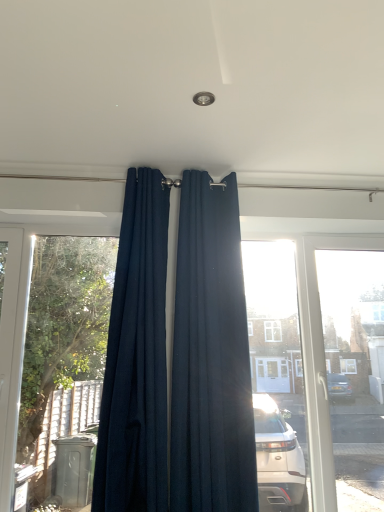
What do you see at coordinates (211, 357) in the screenshot?
I see `navy blue fabric curtain at center, the 1th curtain positioned from the right` at bounding box center [211, 357].

Find the location of `navy blue fabric curtain at center, the 1th curtain positioned from the right`. navy blue fabric curtain at center, the 1th curtain positioned from the right is located at coordinates click(x=211, y=357).

How much space does navy blue fabric curtain at center, which appears as the first curtain when viewed from the left, occupy horizontally?

The width of navy blue fabric curtain at center, which appears as the first curtain when viewed from the left, is 5.21 inches.

Find the location of a particular element. navy blue fabric curtain at center, which appears as the first curtain when viewed from the left is located at coordinates (136, 358).

The image size is (384, 512). What do you see at coordinates (136, 358) in the screenshot?
I see `navy blue fabric curtain at center, which appears as the first curtain when viewed from the left` at bounding box center [136, 358].

Identify the location of navy blue fabric curtain at center, the second curtain positioned from the left. This screenshot has height=512, width=384. (211, 357).

Considering the relative positions of navy blue fabric curtain at center, the second curtain positioned from the left, and navy blue fabric curtain at center, which appears as the first curtain when viewed from the left, in the image provided, is navy blue fabric curtain at center, the second curtain positioned from the left, to the left of navy blue fabric curtain at center, which appears as the first curtain when viewed from the left, from the viewer's perspective?

Incorrect, navy blue fabric curtain at center, the second curtain positioned from the left, is not on the left side of navy blue fabric curtain at center, which appears as the first curtain when viewed from the left.

Which object is closer to the camera taking this photo, navy blue fabric curtain at center, the second curtain positioned from the left, or navy blue fabric curtain at center, which appears as the first curtain when viewed from the left?

Positioned in front is navy blue fabric curtain at center, which appears as the first curtain when viewed from the left.

Is point (118, 307) positioned behind point (143, 326)?

Yes, point (118, 307) is behind point (143, 326).

From the image's perspective, is navy blue fabric curtain at center, the second curtain positioned from the left, located above navy blue fabric curtain at center, which appears as the first curtain when viewed from the left?

Incorrect, from the image's perspective, navy blue fabric curtain at center, the second curtain positioned from the left, is lower than navy blue fabric curtain at center, which appears as the first curtain when viewed from the left.

From a real-world perspective, which is physically above, navy blue fabric curtain at center, the second curtain positioned from the left, or navy blue fabric curtain at center, the 2th curtain when ordered from right to left?

navy blue fabric curtain at center, the 2th curtain when ordered from right to left, from a real-world perspective.

Between navy blue fabric curtain at center, the second curtain positioned from the left, and navy blue fabric curtain at center, which appears as the first curtain when viewed from the left, which one has larger width?

Wider between the two is navy blue fabric curtain at center, the second curtain positioned from the left.

Is navy blue fabric curtain at center, the second curtain positioned from the left, taller than navy blue fabric curtain at center, the 2th curtain when ordered from right to left?

Yes.

Is navy blue fabric curtain at center, the 1th curtain positioned from the right, smaller than navy blue fabric curtain at center, the 2th curtain when ordered from right to left?

No.

Do you think navy blue fabric curtain at center, the second curtain positioned from the left, is within navy blue fabric curtain at center, which appears as the first curtain when viewed from the left, or outside of it?

navy blue fabric curtain at center, the second curtain positioned from the left, is spatially situated outside navy blue fabric curtain at center, which appears as the first curtain when viewed from the left.

Is navy blue fabric curtain at center, the second curtain positioned from the left, directly adjacent to navy blue fabric curtain at center, the 2th curtain when ordered from right to left?

No, navy blue fabric curtain at center, the second curtain positioned from the left, is not with navy blue fabric curtain at center, the 2th curtain when ordered from right to left.

Is navy blue fabric curtain at center, the 1th curtain positioned from the right, turned away from navy blue fabric curtain at center, which appears as the first curtain when viewed from the left?

navy blue fabric curtain at center, the 1th curtain positioned from the right, is not turned away from navy blue fabric curtain at center, which appears as the first curtain when viewed from the left.

How far apart are navy blue fabric curtain at center, the second curtain positioned from the left, and navy blue fabric curtain at center, the 2th curtain when ordered from right to left?

The distance of navy blue fabric curtain at center, the second curtain positioned from the left, from navy blue fabric curtain at center, the 2th curtain when ordered from right to left, is 4.21 inches.

The height and width of the screenshot is (512, 384). Find the location of `curtain above the navy blue fabric curtain at center, the 1th curtain positioned from the right (from a real-world perspective)`. curtain above the navy blue fabric curtain at center, the 1th curtain positioned from the right (from a real-world perspective) is located at coordinates (136, 358).

Which object is positioned more to the right, navy blue fabric curtain at center, which appears as the first curtain when viewed from the left, or navy blue fabric curtain at center, the second curtain positioned from the left?

navy blue fabric curtain at center, the second curtain positioned from the left, is more to the right.

Which object is closer to the camera, navy blue fabric curtain at center, which appears as the first curtain when viewed from the left, or navy blue fabric curtain at center, the second curtain positioned from the left?

navy blue fabric curtain at center, which appears as the first curtain when viewed from the left, is closer to the camera.

Between point (123, 232) and point (206, 309), which one is positioned behind?

Positioned behind is point (123, 232).

From the image's perspective, relative to navy blue fabric curtain at center, the 1th curtain positioned from the right, is navy blue fabric curtain at center, the 2th curtain when ordered from right to left, above or below?

From the image's perspective, navy blue fabric curtain at center, the 2th curtain when ordered from right to left, appears above navy blue fabric curtain at center, the 1th curtain positioned from the right.

From a real-world perspective, is navy blue fabric curtain at center, which appears as the first curtain when viewed from the left, located higher than navy blue fabric curtain at center, the second curtain positioned from the left?

Yes.

Considering the sizes of objects navy blue fabric curtain at center, the 2th curtain when ordered from right to left, and navy blue fabric curtain at center, the 1th curtain positioned from the right, in the image provided, who is thinner, navy blue fabric curtain at center, the 2th curtain when ordered from right to left, or navy blue fabric curtain at center, the 1th curtain positioned from the right,?

With smaller width is navy blue fabric curtain at center, the 2th curtain when ordered from right to left.

Can you confirm if navy blue fabric curtain at center, the 2th curtain when ordered from right to left, is shorter than navy blue fabric curtain at center, the 1th curtain positioned from the right?

Yes, navy blue fabric curtain at center, the 2th curtain when ordered from right to left, is shorter than navy blue fabric curtain at center, the 1th curtain positioned from the right.

Considering the relative sizes of navy blue fabric curtain at center, the 2th curtain when ordered from right to left, and navy blue fabric curtain at center, the second curtain positioned from the left, in the image provided, is navy blue fabric curtain at center, the 2th curtain when ordered from right to left, bigger than navy blue fabric curtain at center, the second curtain positioned from the left,?

No, navy blue fabric curtain at center, the 2th curtain when ordered from right to left, is not bigger than navy blue fabric curtain at center, the second curtain positioned from the left.

From the picture: Would you say navy blue fabric curtain at center, the 2th curtain when ordered from right to left, contains navy blue fabric curtain at center, the second curtain positioned from the left?

No, navy blue fabric curtain at center, the second curtain positioned from the left, is not inside navy blue fabric curtain at center, the 2th curtain when ordered from right to left.

Is navy blue fabric curtain at center, which appears as the first curtain when viewed from the left, far from navy blue fabric curtain at center, the second curtain positioned from the left?

navy blue fabric curtain at center, which appears as the first curtain when viewed from the left, is actually quite close to navy blue fabric curtain at center, the second curtain positioned from the left.

Is navy blue fabric curtain at center, which appears as the first curtain when viewed from the left, facing away from navy blue fabric curtain at center, the second curtain positioned from the left?

That's not correct — navy blue fabric curtain at center, which appears as the first curtain when viewed from the left, is not looking away from navy blue fabric curtain at center, the second curtain positioned from the left.

In the scene shown: How many degrees apart are the facing directions of navy blue fabric curtain at center, the 2th curtain when ordered from right to left, and navy blue fabric curtain at center, the 1th curtain positioned from the right?

The facing directions of navy blue fabric curtain at center, the 2th curtain when ordered from right to left, and navy blue fabric curtain at center, the 1th curtain positioned from the right, are 0.000348 degrees apart.

You are a GUI agent. You are given a task and a screenshot of the screen. Output one action in this format:
    pyautogui.click(x=<x>, y=<y>)
    Task: Click on the curtain above the navy blue fabric curtain at center, the second curtain positioned from the left (from the image's perspective)
    
    Given the screenshot: What is the action you would take?
    pyautogui.click(x=136, y=358)

This screenshot has height=512, width=384. I want to click on curtain directly beneath the navy blue fabric curtain at center, which appears as the first curtain when viewed from the left (from a real-world perspective), so click(211, 357).

Locate an element on the screen. The height and width of the screenshot is (512, 384). curtain behind the navy blue fabric curtain at center, the 2th curtain when ordered from right to left is located at coordinates (211, 357).